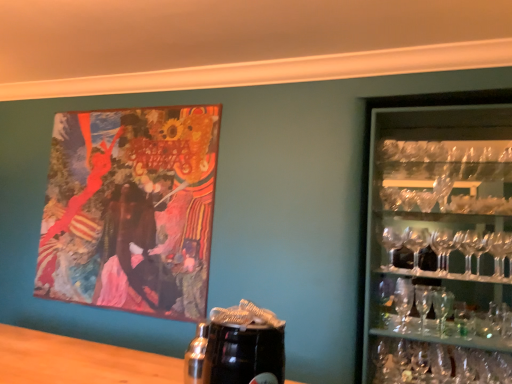
Question: Is clear glass martini glass at right bigger than transparent glassware at right?

Choices:
 (A) no
 (B) yes

Answer: (A)

Question: From a real-world perspective, is clear glass martini glass at right physically below transparent glassware at right?

Choices:
 (A) no
 (B) yes

Answer: (B)

Question: From the image's perspective, is clear glass martini glass at right beneath transparent glassware at right?

Choices:
 (A) yes
 (B) no

Answer: (A)

Question: Can you confirm if clear glass martini glass at right is taller than transparent glassware at right?

Choices:
 (A) yes
 (B) no

Answer: (B)

Question: Does clear glass martini glass at right appear on the right side of transparent glassware at right?

Choices:
 (A) yes
 (B) no

Answer: (B)

Question: Is clear glass martini glass at right looking in the opposite direction of transparent glassware at right?

Choices:
 (A) no
 (B) yes

Answer: (B)

Question: Is transparent glassware at right to the left of oil painting at upper left from the viewer's perspective?

Choices:
 (A) yes
 (B) no

Answer: (B)

Question: Is transparent glassware at right outside of oil painting at upper left?

Choices:
 (A) yes
 (B) no

Answer: (A)

Question: Is transparent glassware at right further to camera compared to oil painting at upper left?

Choices:
 (A) yes
 (B) no

Answer: (B)

Question: Does transparent glassware at right have a smaller size compared to oil painting at upper left?

Choices:
 (A) yes
 (B) no

Answer: (B)

Question: Is transparent glassware at right thinner than oil painting at upper left?

Choices:
 (A) yes
 (B) no

Answer: (B)

Question: From a real-world perspective, is transparent glassware at right located beneath oil painting at upper left?

Choices:
 (A) no
 (B) yes

Answer: (B)

Question: Is oil painting at upper left bigger than clear glass martini glass at right?

Choices:
 (A) no
 (B) yes

Answer: (B)